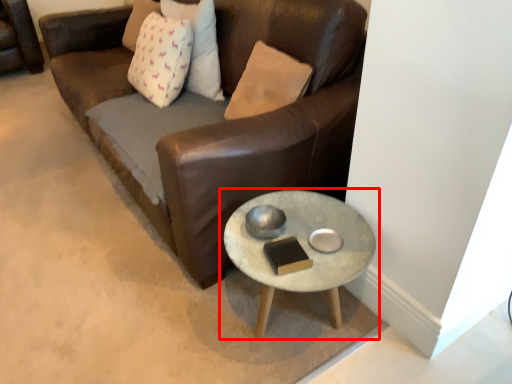
Question: From the image's perspective, where is coffee table (annotated by the red box) located in relation to pillow in the image?

Choices:
 (A) above
 (B) below

Answer: (B)